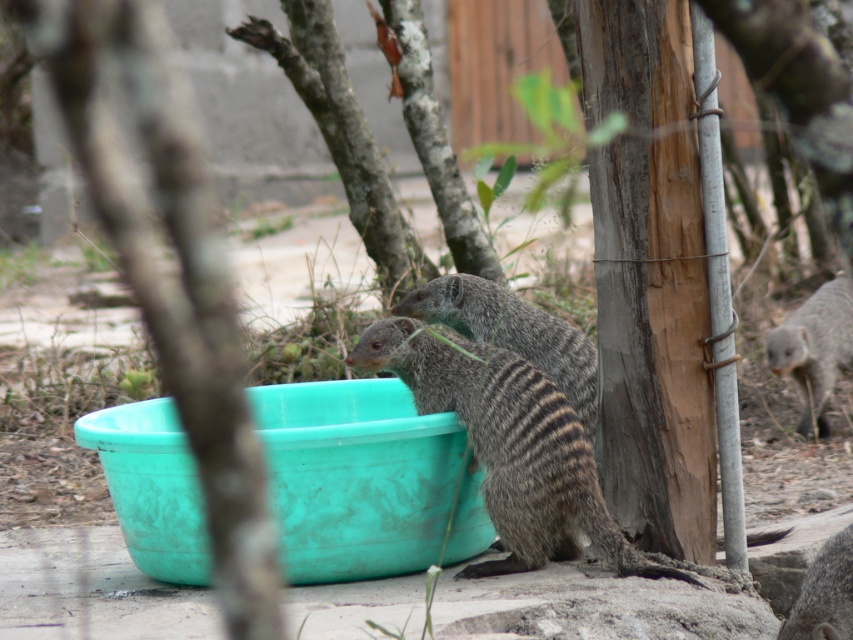
Who is more distant from viewer, (x=801, y=356) or (x=798, y=595)?

The point (x=801, y=356) is more distant.

Who is more forward, (798, 355) or (801, 612)?

Positioned in front is point (801, 612).

Locate an element on the screen. The width and height of the screenshot is (853, 640). gray fur at right is located at coordinates click(x=814, y=348).

Does green plastic bucket at lower center have a smaller size compared to gray fur at center?

No.

Does point (236, 324) come behind point (851, 529)?

Yes.

Identify the location of green plastic bucket at lower center. This screenshot has width=853, height=640. (167, 272).

At what (x,y) coordinates should I click in order to perform the action: click on green plastic bucket at lower center. Please return your answer as a coordinate pair (x, y). Looking at the image, I should click on (167, 272).

In order to click on green plastic bucket at lower center in this screenshot , I will do `click(167, 272)`.

Who is lower down, green plastic bucket at lower center or gray fur at right?

Positioned lower is gray fur at right.

Find the location of a particular element. green plastic bucket at lower center is located at coordinates (167, 272).